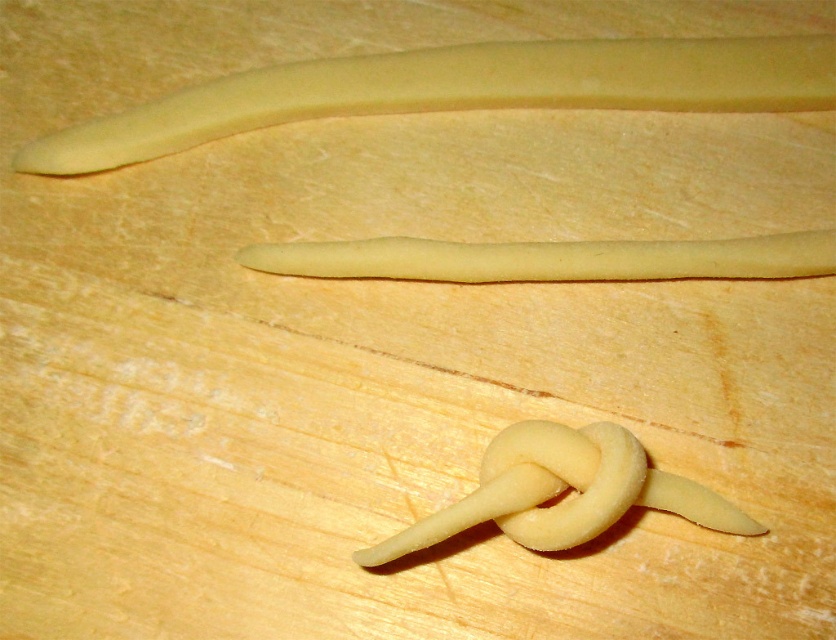
Question: Is yellow matte dough at upper center to the right of matte yellow dough at center from the viewer's perspective?

Choices:
 (A) yes
 (B) no

Answer: (B)

Question: Estimate the real-world distances between objects in this image. Which object is farther from the matte yellow dough at center?

Choices:
 (A) yellow dough stick at center
 (B) yellow matte dough at upper center

Answer: (B)

Question: Can you confirm if yellow matte dough at upper center is positioned below matte yellow dough at center?

Choices:
 (A) no
 (B) yes

Answer: (A)

Question: Which point appears closest to the camera in this image?

Choices:
 (A) (562, 67)
 (B) (258, 259)

Answer: (B)

Question: Estimate the real-world distances between objects in this image. Which object is farther from the matte yellow dough at center?

Choices:
 (A) yellow matte dough at upper center
 (B) yellow dough stick at center

Answer: (A)

Question: Does matte yellow dough at center have a lesser width compared to yellow dough stick at center?

Choices:
 (A) no
 (B) yes

Answer: (B)